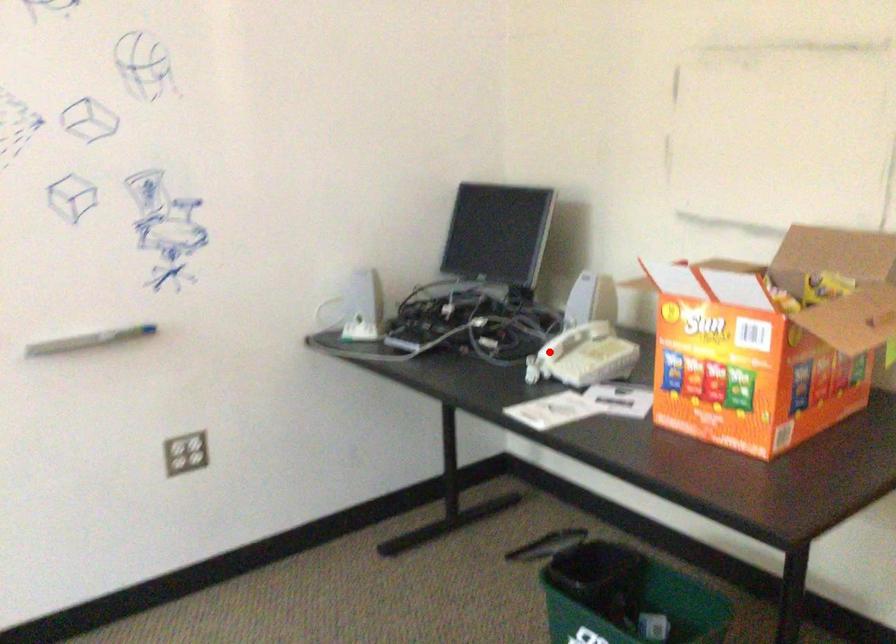
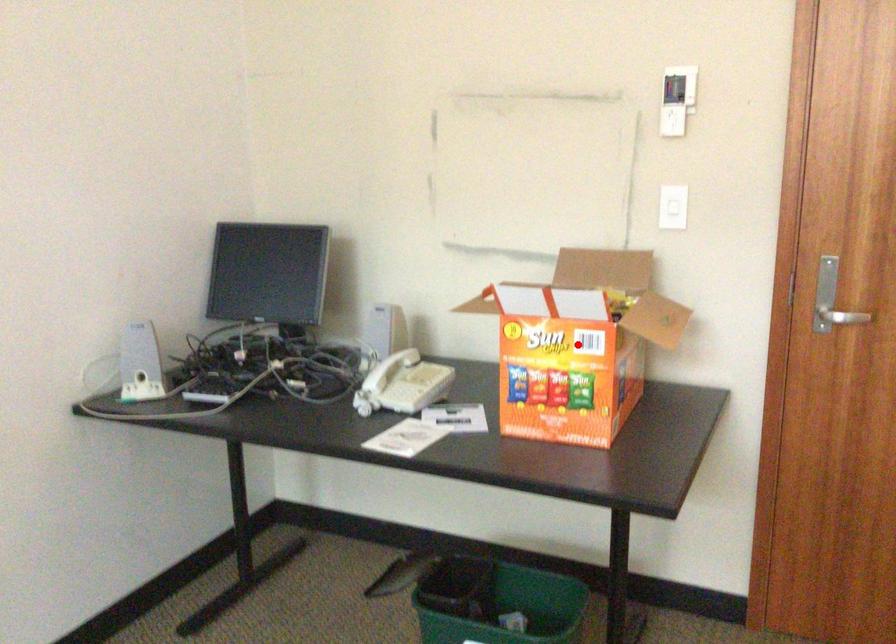
From the picture: I am providing you with two images of the same scene from different viewpoints. A red point is marked on the first image and another point is marked on the second image. Is the marked point in image1 the same physical position as the marked point in image2?

No